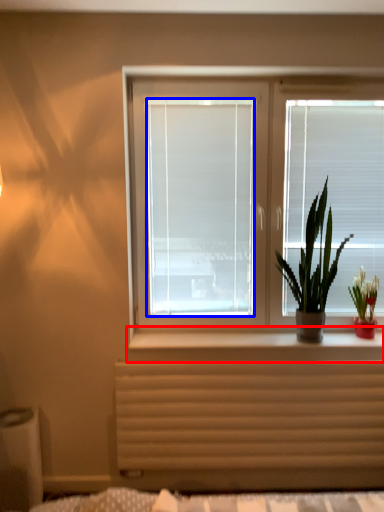
Question: Which of the following is the closest to the observer, window sill (highlighted by a red box) or window screen (highlighted by a blue box)?

Choices:
 (A) window sill
 (B) window screen

Answer: (A)